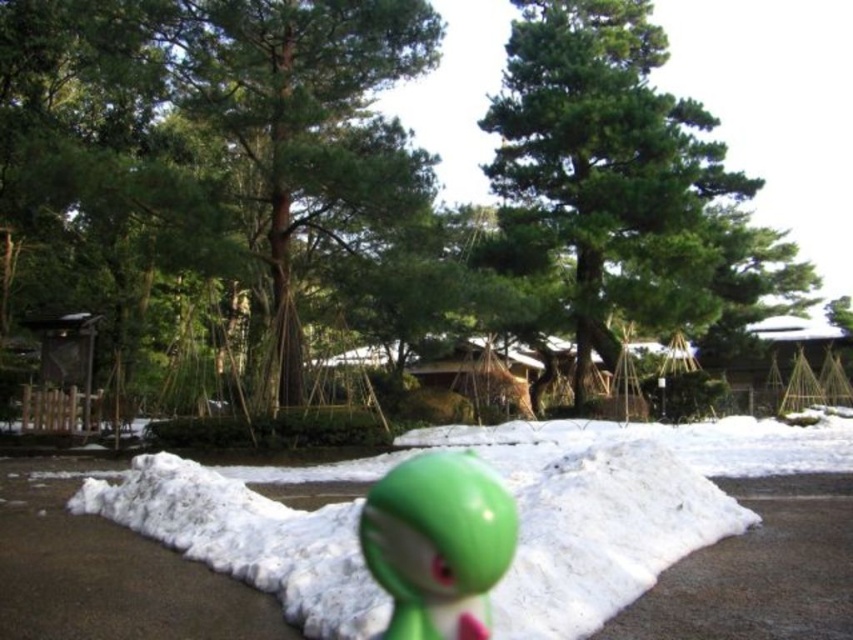
Question: Estimate the real-world distances between objects in this image. Which object is farther from the green matte toy at center?

Choices:
 (A) white fluffy snow at center
 (B) green matte tree at center

Answer: (B)

Question: Among these points, which one is nearest to the camera?

Choices:
 (A) (485, 323)
 (B) (415, 636)
 (C) (566, 552)

Answer: (B)

Question: Does white fluffy snow at center have a greater width compared to green matte toy at center?

Choices:
 (A) yes
 (B) no

Answer: (A)

Question: Does green matte tree at center come behind green matte toy at center?

Choices:
 (A) yes
 (B) no

Answer: (A)

Question: Is green matte tree at center wider than green matte toy at center?

Choices:
 (A) no
 (B) yes

Answer: (B)

Question: Which point appears farthest from the camera in this image?

Choices:
 (A) (399, 556)
 (B) (227, 470)

Answer: (B)